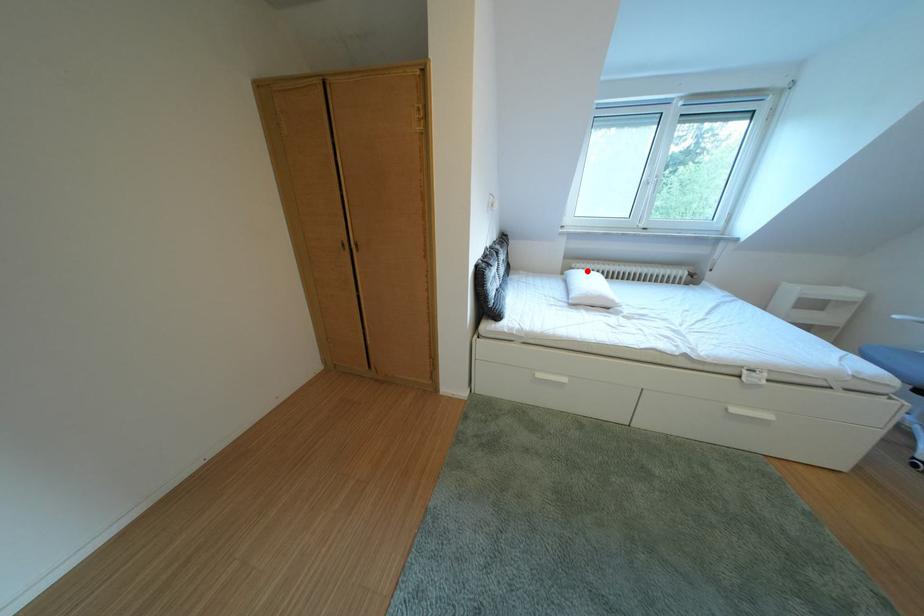
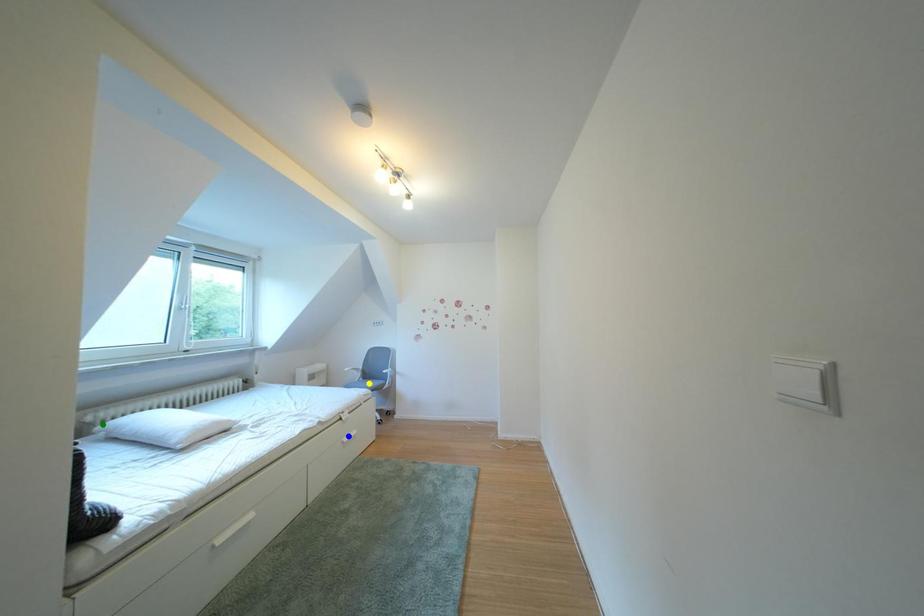
Question: I am providing you with two images of the same scene from different viewpoints. A red point is marked on the first image. You are given multiple points on the second image. Which mark in image 2 goes with the point in image 1?

Choices:
 (A) green point
 (B) yellow point
 (C) blue point

Answer: (A)